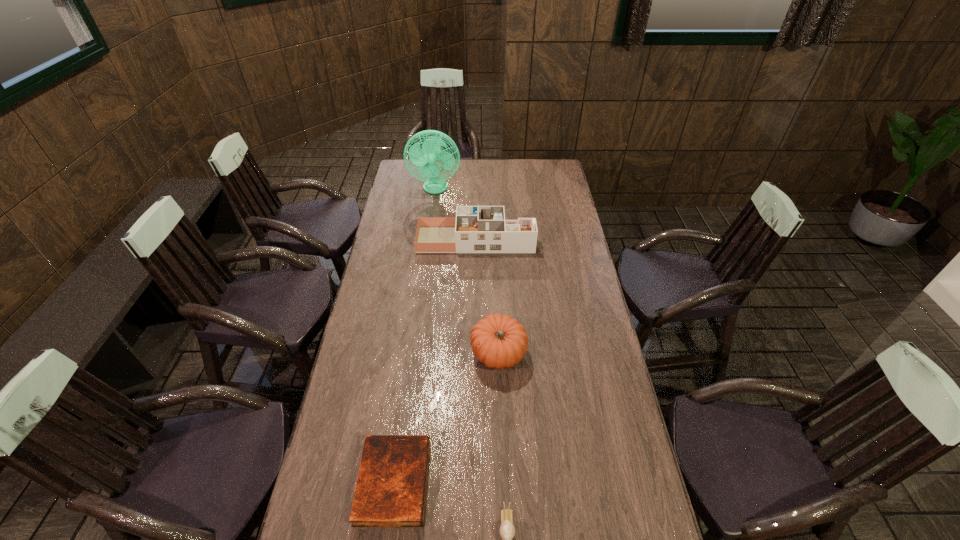
I want to click on fan, so click(426, 158).

Find the location of a particular element. the tallest object is located at coordinates (426, 158).

At what (x,y) coordinates should I click in order to perform the action: click on pumpkin. Please return your answer as a coordinate pair (x, y). Image resolution: width=960 pixels, height=540 pixels. Looking at the image, I should click on (499, 341).

Where is `dollhouse`? dollhouse is located at coordinates (476, 229).

The width and height of the screenshot is (960, 540). I want to click on Bible, so click(390, 491).

Identify the location of vacant position located in front of the farthest object to blow air. (431, 225).

The height and width of the screenshot is (540, 960). What are the coordinates of `vacant area located 0.130m on the front of the pumpkin` in the screenshot? It's located at (500, 414).

Where is `vacant space located at the entrance of the dollhouse`? Image resolution: width=960 pixels, height=540 pixels. vacant space located at the entrance of the dollhouse is located at coordinates (556, 239).

I want to click on vacant space situated 0.090m on the spine side of the Bible, so click(x=459, y=482).

I want to click on object positioned at the far edge, so click(426, 158).